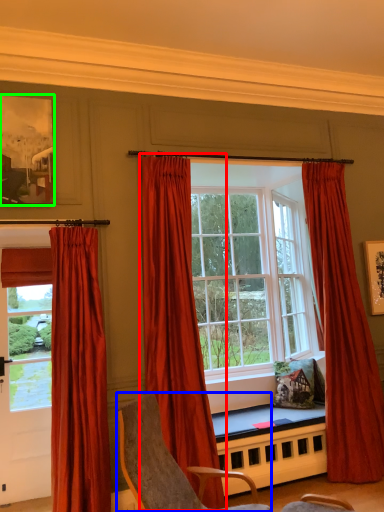
Question: Which object is positioned farthest from curtain (highlighted by a red box)? Select from chair (highlighted by a blue box) and picture frame (highlighted by a green box).

Choices:
 (A) chair
 (B) picture frame

Answer: (B)